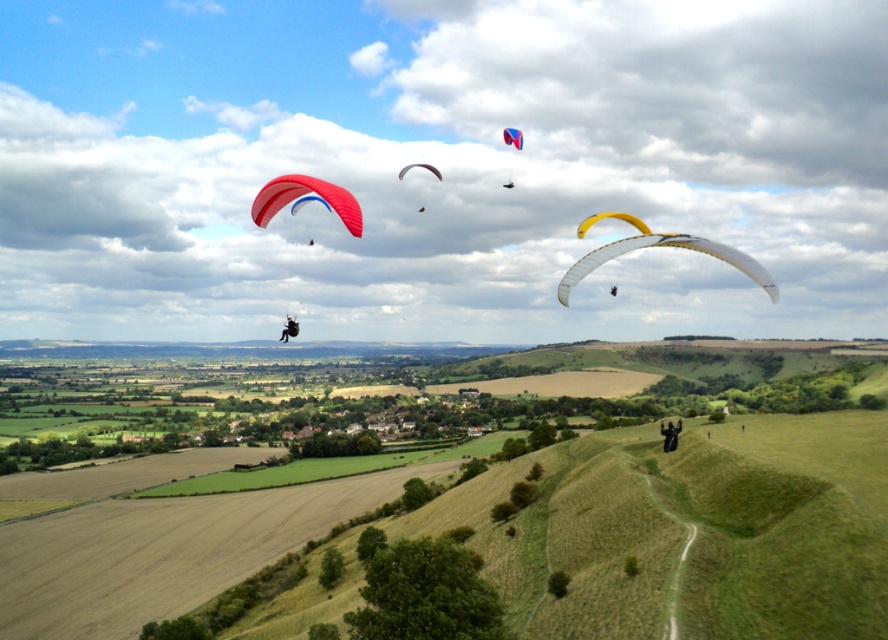
Question: Does matte red paraglider at center-left have a smaller size compared to matte red paraglider at center?

Choices:
 (A) no
 (B) yes

Answer: (B)

Question: In this image, where is blue glossy parachute at upper center located relative to black fabric parachute at upper center?

Choices:
 (A) left
 (B) right

Answer: (B)

Question: Based on their relative distances, which object is farther from the yellow matte paraglider at center?

Choices:
 (A) matte red paraglider at center-left
 (B) blue glossy parachute at upper center

Answer: (A)

Question: Is matte red paraglider at center-left to the left of black fabric parachute at upper center from the viewer's perspective?

Choices:
 (A) no
 (B) yes

Answer: (B)

Question: Estimate the real-world distances between objects in this image. Which object is closer to the blue and white fabric parachute at upper center?

Choices:
 (A) matte red paraglider at upper center
 (B) yellow matte paraglider at center

Answer: (B)

Question: Which object is positioned farthest from the black fabric parachute at center?

Choices:
 (A) black fabric parachute at upper center
 (B) blue and white fabric parachute at upper center
 (C) blue glossy parachute at upper center
 (D) matte red paraglider at upper center

Answer: (B)